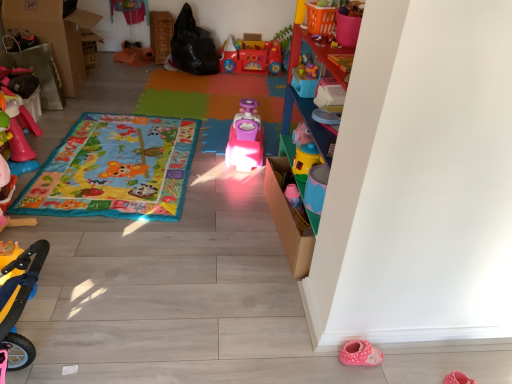
Identify the location of vacant area that is in front of multicolored fabric play mat at center, which is counted as the second blanket, starting from the back. (154, 274).